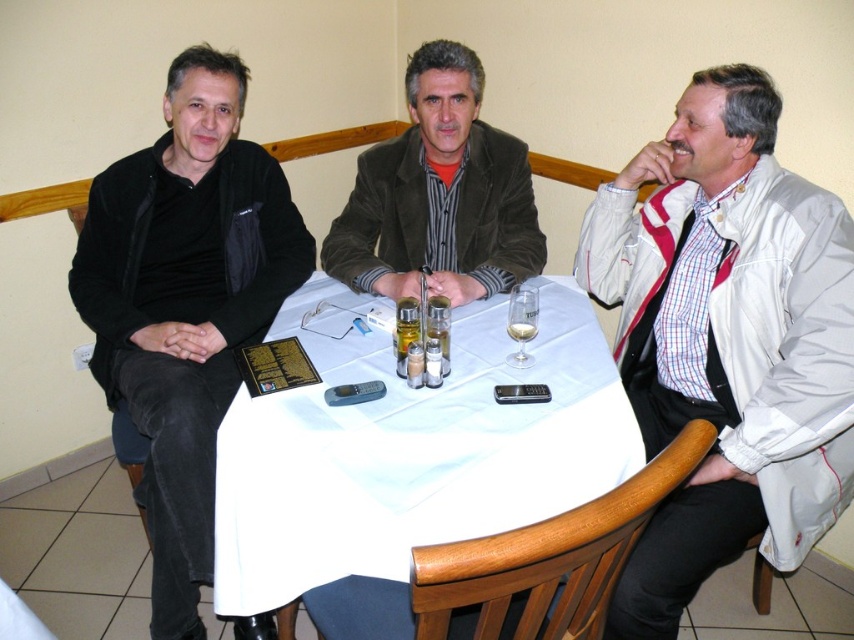
You are a tailor who needs to know the jacket sizes to adjust them. Which jacket is wider, the white leather jacket at right or the velvet brown jacket at center?

The velvet brown jacket at center is wider than the white leather jacket at right.

You are a server at a restaurant and need to place a new menu on the table. The menu is the same size as the velvet brown jacket at center. Will the white cloth at center be able to cover the menu if placed underneath it?

The white cloth at center is larger in size than the velvet brown jacket at center, so yes, the white cloth at center will be able to cover the menu placed underneath it since it is bigger than the jacket, which is the same size as the menu.

You are a photographer setting up for a group photo. You need to position the black matte jacket at left and the velvet brown jacket at center in a way that aligns with their current positions. Which jacket should you place on the left side of the photo composition?

The black matte jacket at left should be placed on the left side of the photo composition because it is already positioned to the left of the velvet brown jacket at center in the scene.